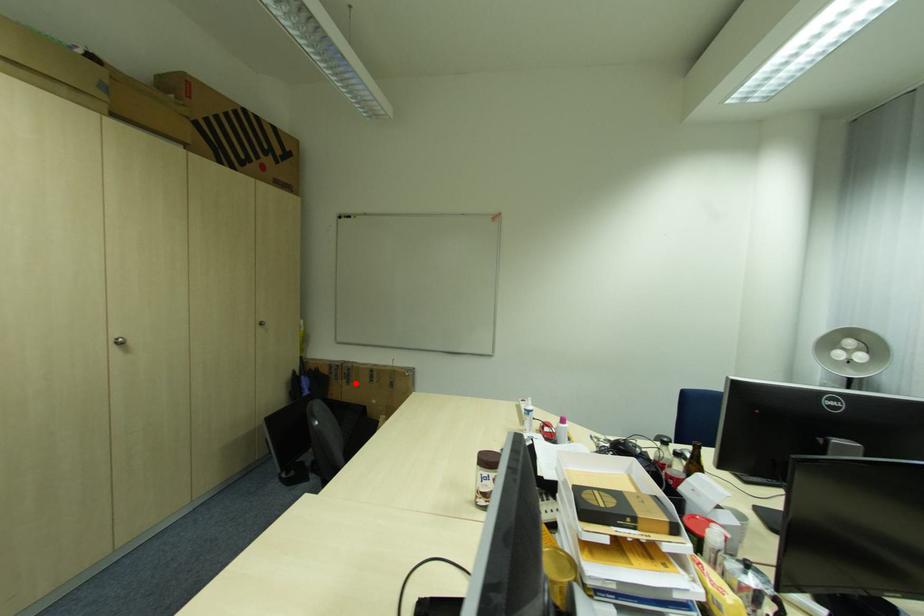
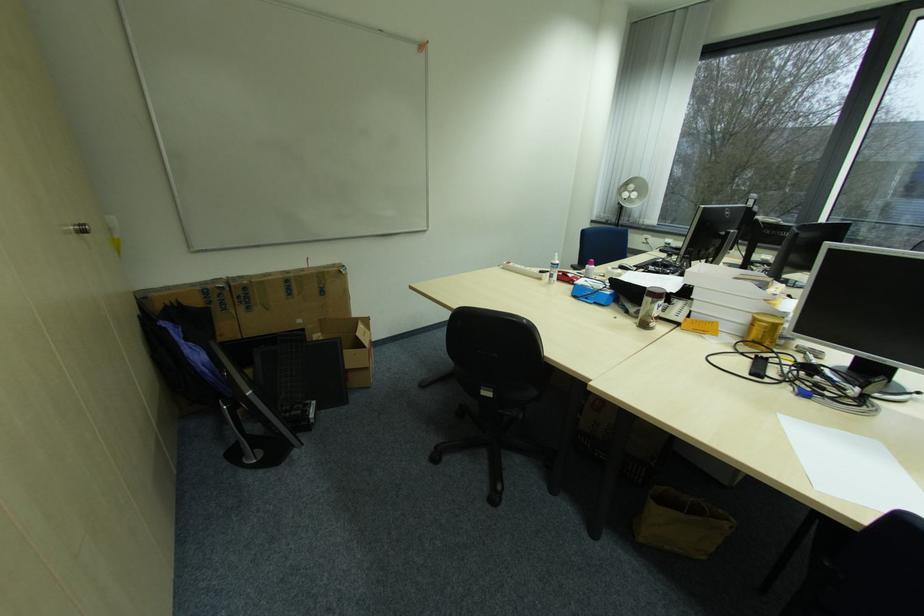
Find the pixel in the second image that matches the highlighted location in the first image.

(257, 309)